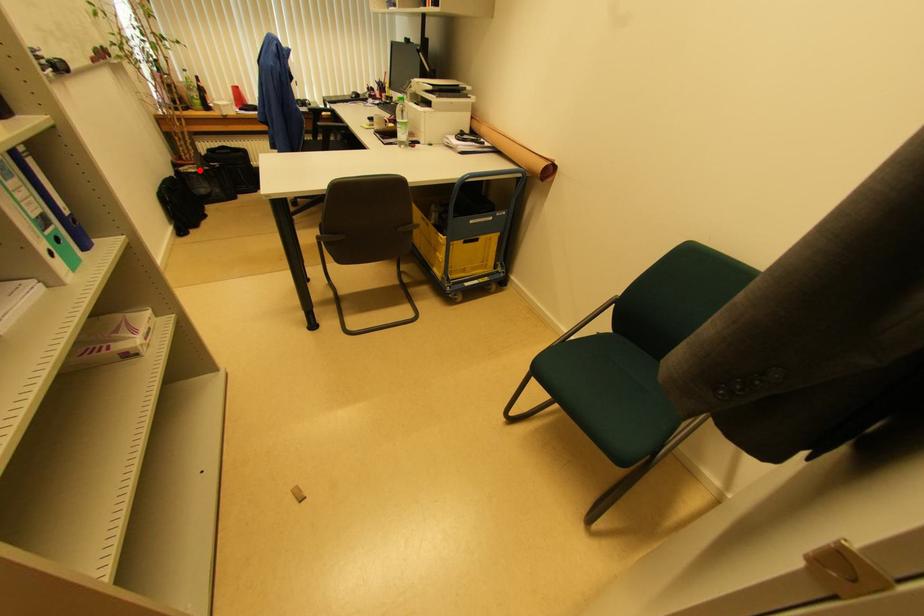
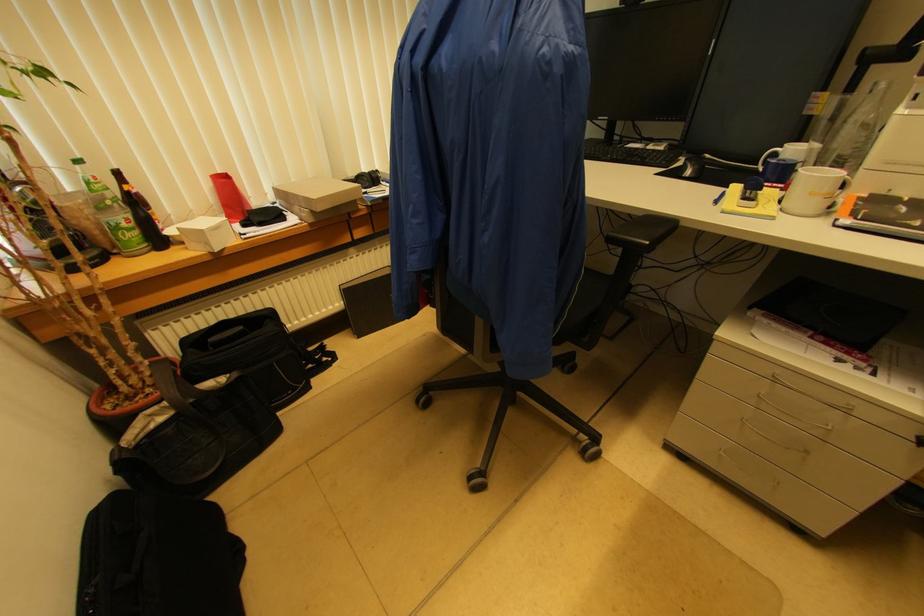
Locate, in the second image, the point that corresponds to the highlighted location in the first image.

(175, 408)